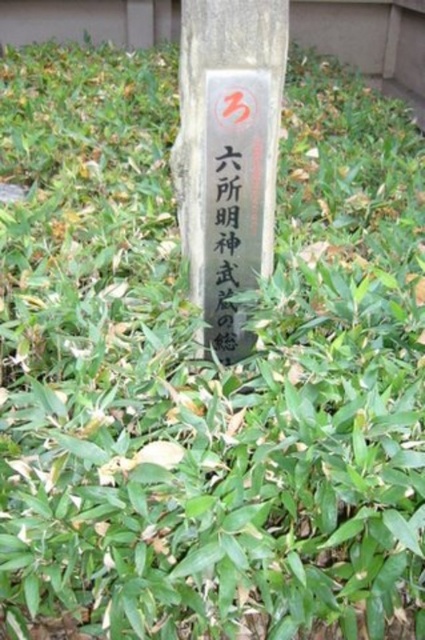
Question: Does black stone sign at center appear on the right side of green paper at center?

Choices:
 (A) yes
 (B) no

Answer: (B)

Question: Does black stone sign at center have a larger size compared to green paper at center?

Choices:
 (A) no
 (B) yes

Answer: (B)

Question: Is black stone sign at center positioned before green paper at center?

Choices:
 (A) no
 (B) yes

Answer: (B)